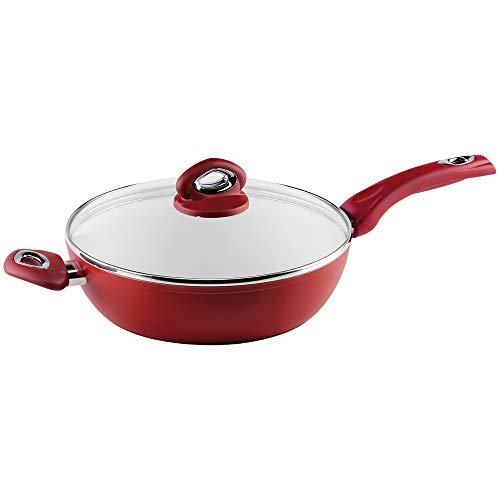
The height and width of the screenshot is (500, 500). In order to click on metal rim inside lid handle in this screenshot , I will do `click(219, 186)`.